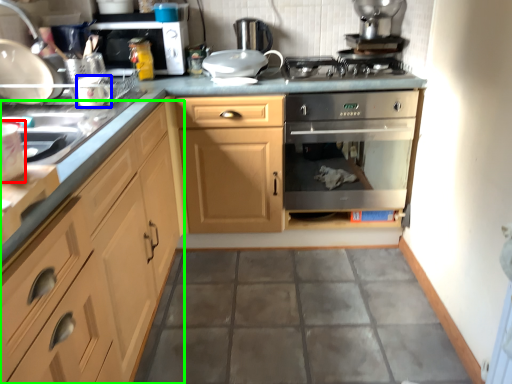
Question: Based on their relative distances, which object is farther from appliance (highlighted by a red box)? Choose from appliance (highlighted by a blue box) and cabinetry (highlighted by a green box).

Choices:
 (A) appliance
 (B) cabinetry

Answer: (A)